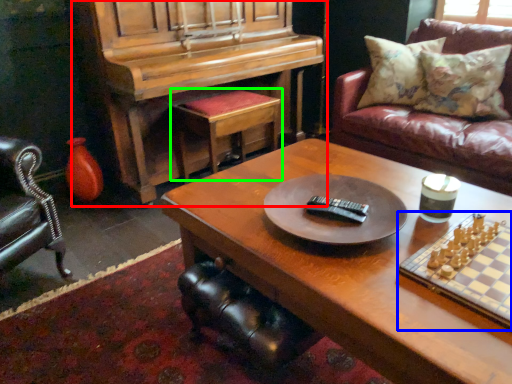
Question: Considering the real-world distances, which object is farthest from piano (highlighted by a red box)? board game (highlighted by a blue box) or stool (highlighted by a green box)?

Choices:
 (A) board game
 (B) stool

Answer: (A)